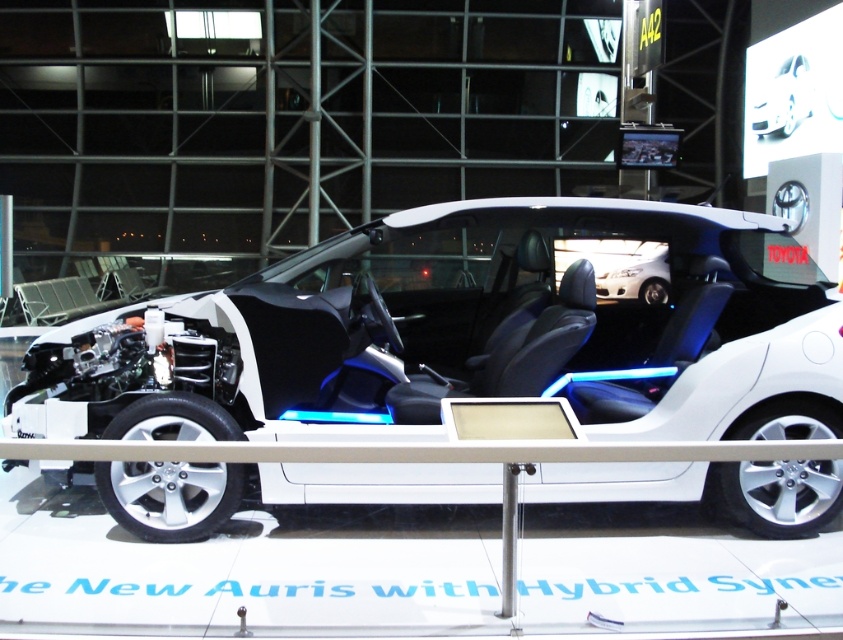
You are a photographer at the auto show and want to capture both the white matte concept car at center and the white matte car at center in a single shot. Since you want them to look balanced, which car should you place closer to the camera to make them appear the same size?

To make the white matte concept car at center and the white matte car at center appear the same size in the photo, place the smaller white matte car at center closer to the camera since the white matte concept car at center is larger in size.

You are a car designer reviewing the layout of the Toyota Auris hybrid exhibit. You need to ensure that the central display panel, which is placed at point (x=466, y=333), is positioned correctly relative to the white matte concept car at center. Is the display panel located on the car or outside of it?

The point (x=466, y=333) corresponds to the white matte concept car at center, so the display panel is located on the car.